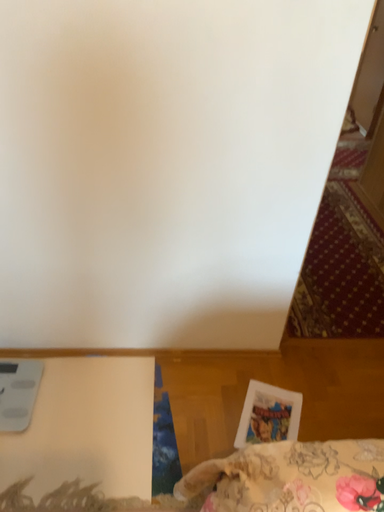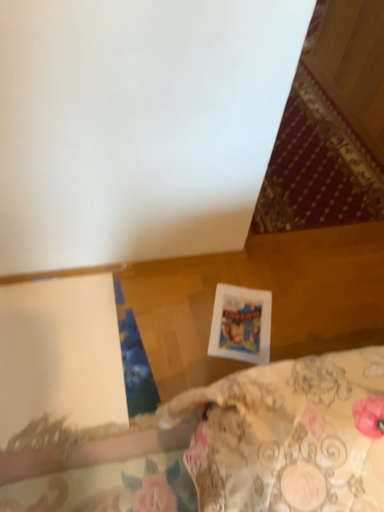
Question: Which way did the camera rotate in the video?

Choices:
 (A) rotated upward
 (B) rotated downward

Answer: (B)